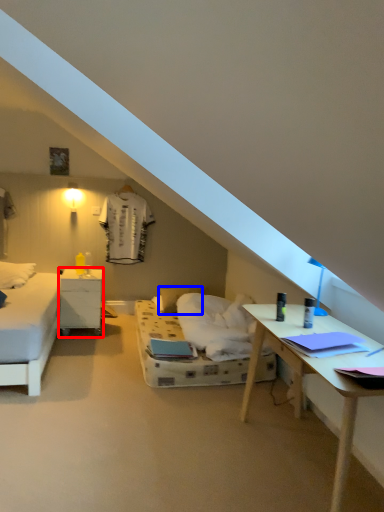
Question: Which of the following is the closest to the observer, nightstand (highlighted by a red box) or pillow (highlighted by a blue box)?

Choices:
 (A) nightstand
 (B) pillow

Answer: (A)